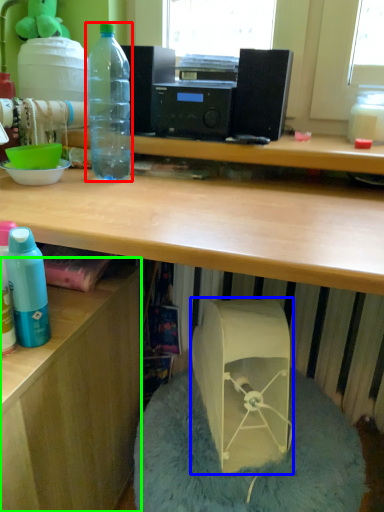
Question: Based on their relative distances, which object is farther from bottle (highlighted by a red box)? Choose from wide (highlighted by a blue box) and desk (highlighted by a green box).

Choices:
 (A) wide
 (B) desk

Answer: (A)